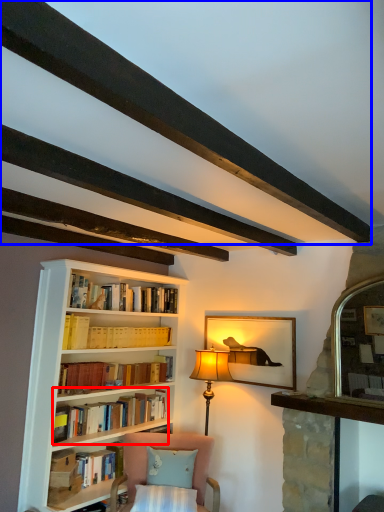
Question: Which point is closer to the camera, book (highlighted by a red box) or plank (highlighted by a blue box)?

Choices:
 (A) book
 (B) plank

Answer: (B)